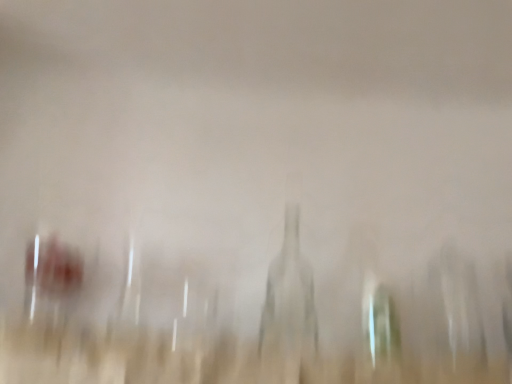
The width and height of the screenshot is (512, 384). What do you see at coordinates (288, 312) in the screenshot?
I see `transparent glass bottle at center` at bounding box center [288, 312].

Measure the distance between point (x=292, y=363) and camera.

Point (x=292, y=363) and camera are 75.40 centimeters apart from each other.

Identify the location of transparent glass bottle at center. tap(288, 312).

Image resolution: width=512 pixels, height=384 pixels. What are the coordinates of `transparent glass bottle at center` in the screenshot? It's located at pyautogui.click(x=288, y=312).